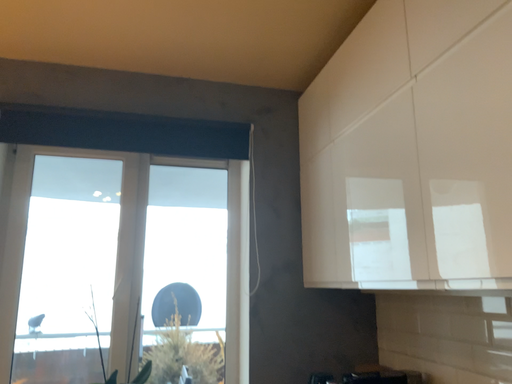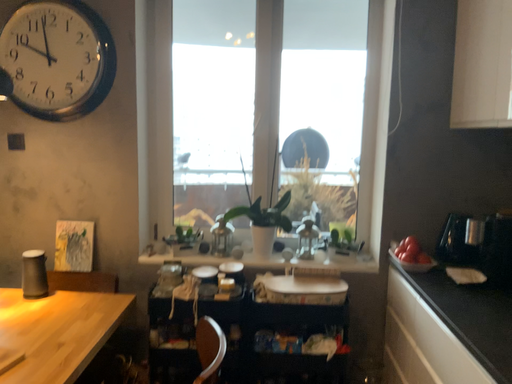
Question: Which way did the camera rotate in the video?

Choices:
 (A) rotated downward
 (B) rotated upward

Answer: (A)